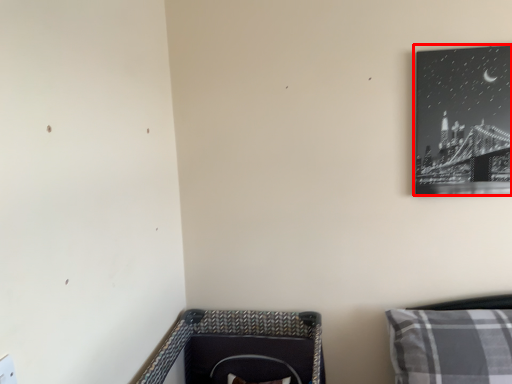
Question: Where is picture frame (annotated by the red box) located in relation to pillow in the image?

Choices:
 (A) left
 (B) right

Answer: (B)